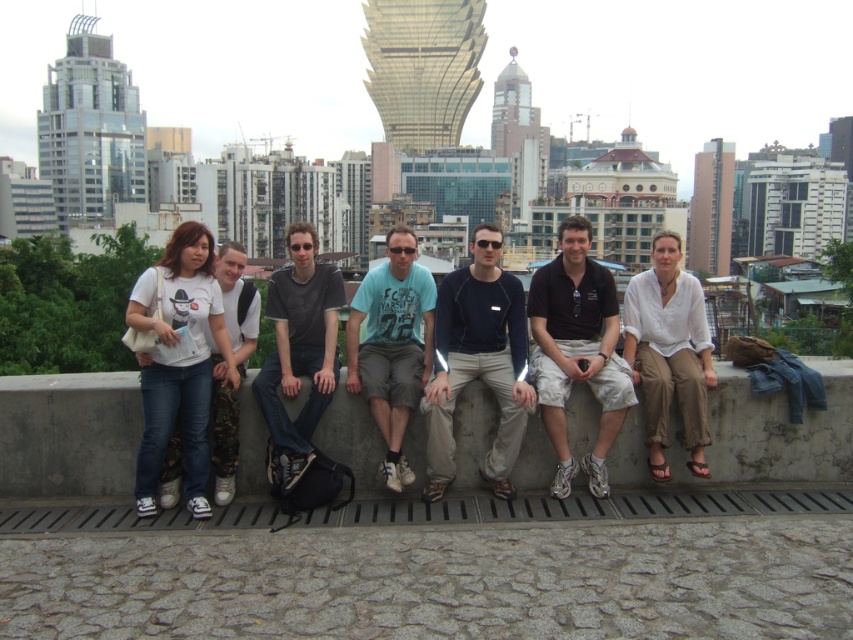
You are a photographer adjusting your camera settings to focus on two specific points in the scene. The first point is at coordinates point (x=538, y=353) and the second is at point (x=223, y=403). Which point should you focus on first if you want to ensure the closest object is in sharp focus?

Point (x=538, y=353) is further to the camera than point (x=223, y=403), so you should focus on point (x=538, y=353) first to ensure the closest object is in sharp focus.